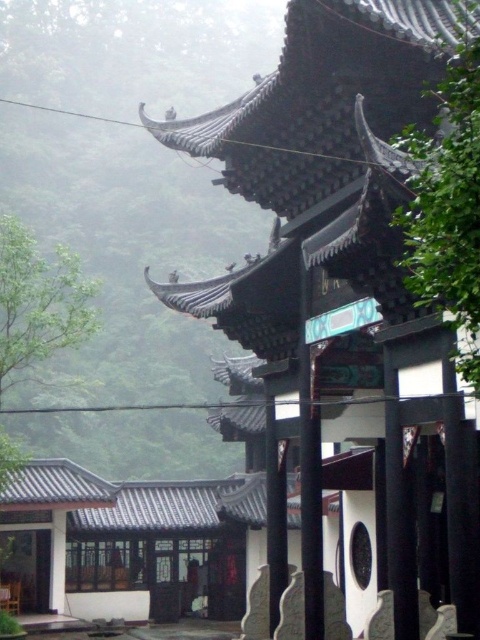
You are an architect examining the traditional Chinese structure. You notice the black tile roof at center and the foggy translucent at left. Which of these two elements has a smaller width when viewed from the front?

The black tile roof at center is thinner than the foggy translucent at left, so the black tile roof at center has a smaller width when viewed from the front.

Based on the photo, you are an architect visiting this traditional Chinese structure. You notice the black tile roof at center and the foggy translucent at left. Which of these two elements appears smaller in the image?

The black tile roof at center appears smaller than the foggy translucent at left.

You are standing in front of a traditional Chinese building surrounded by mountains. You notice the black tile roof at center and the foggy translucent at left. Which object is closer to you?

The black tile roof at center is closer to you because it is in front of the foggy translucent at left.